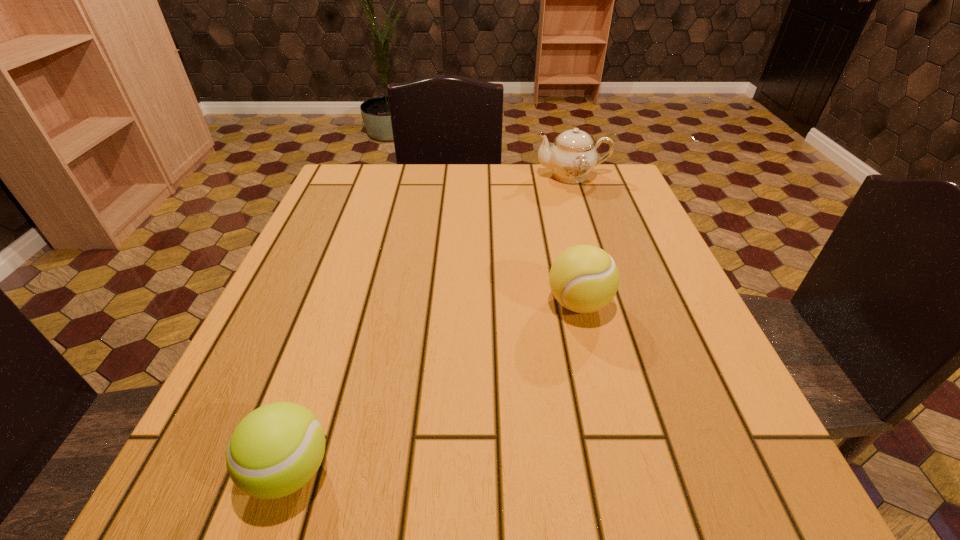
This screenshot has width=960, height=540. In order to click on object at the far edge in this screenshot , I will do `click(572, 156)`.

I want to click on object that is at the near edge, so click(x=276, y=449).

Where is `object that is at the left edge`? The width and height of the screenshot is (960, 540). object that is at the left edge is located at coordinates (276, 449).

Where is `chinaware present at the right edge`? This screenshot has width=960, height=540. chinaware present at the right edge is located at coordinates (572, 156).

Where is `tennis ball positioned at the right edge`? tennis ball positioned at the right edge is located at coordinates (584, 278).

Find the location of `object located in the near left corner section of the desktop`. object located in the near left corner section of the desktop is located at coordinates (276, 449).

Find the location of a particular element. The image size is (960, 540). object at the far right corner is located at coordinates (572, 156).

Identify the location of vacant region at the far edge of the desktop. The width and height of the screenshot is (960, 540). 450,191.

Where is `vacant region at the near edge of the desktop`? This screenshot has height=540, width=960. vacant region at the near edge of the desktop is located at coordinates (611, 490).

In order to click on vacant space at the left edge in this screenshot , I will do `click(367, 233)`.